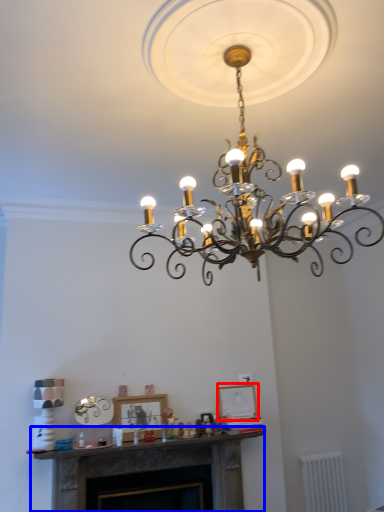
Question: Which object is further to the camera taking this photo, picture frame (highlighted by a red box) or fireplace (highlighted by a blue box)?

Choices:
 (A) picture frame
 (B) fireplace

Answer: (A)